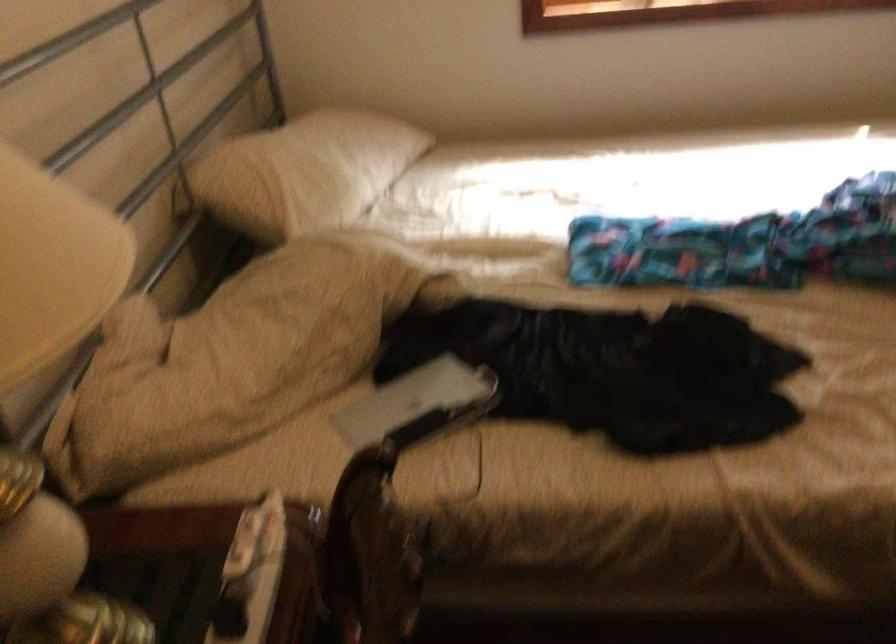
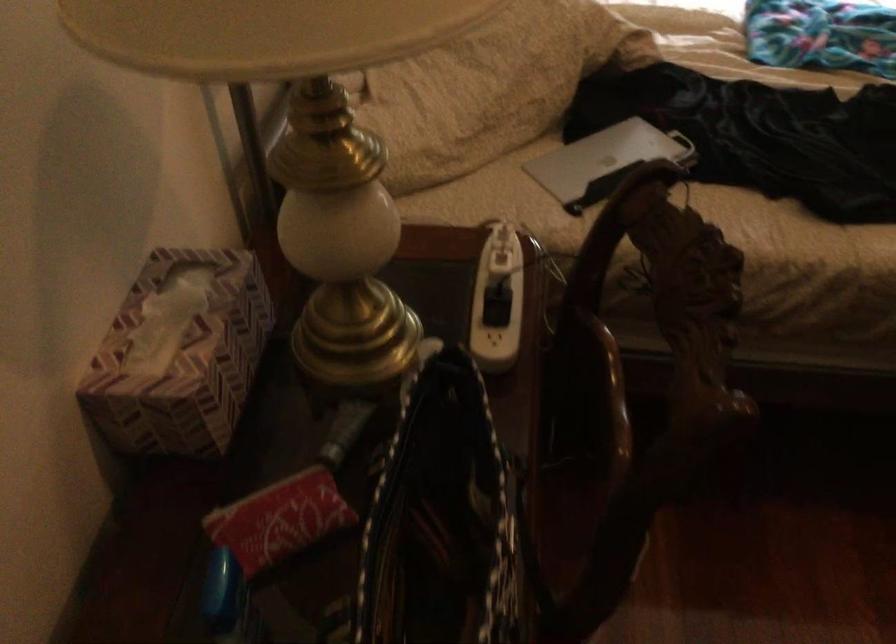
Question: The images are taken continuously from a first-person perspective. In which direction are you moving?

Choices:
 (A) Left
 (B) Right
 (C) Forward
 (D) Backward

Answer: (A)